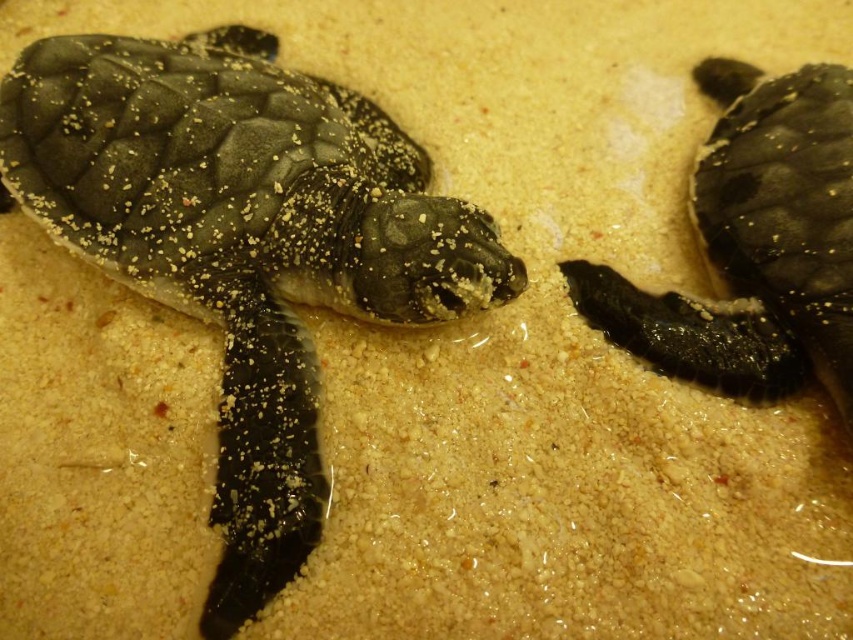
You are observing two points in the image of baby sea turtles. From your viewpoint, which point is closer to you, point (387, 221) or point (704, 234)?

Point (387, 221) is closer to the camera than point (704, 234).

You are a zookeeper observing the two turtles in the enclosure. You need to place a small food dish between them. Based on their positions, where should you place the dish so it is equidistant from both the shiny black turtle at center and the black matte turtle at upper right?

The shiny black turtle at center is positioned under the black matte turtle at upper right, so placing the dish directly between them would require positioning it horizontally centered between the two turtles to ensure equal distance from both.

Looking at this image, you are a wildlife photographer aiming to capture a closeup shot of both the shiny black turtle at center and the black matte turtle at upper right. Given that your camera can only focus on one turtle at a time, which turtle should you choose to ensure the focus is sharp if you want to shoot the larger one?

The shiny black turtle at center is larger in size than the black matte turtle at upper right, so you should choose the shiny black turtle at center to ensure the focus is sharp since it is the larger one.